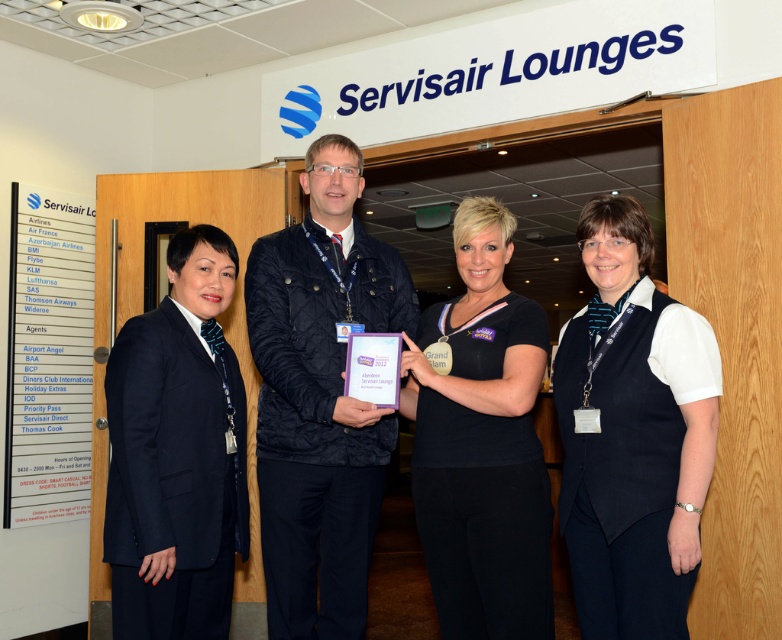
You are at the event and want to take a photo of both the person at point [357,593] and the person at point [221,403]. Since one is behind the other, how should you position yourself to capture both in the frame?

To capture both the person at point [357,593] and the person at point [221,403] in the frame, position yourself so that the person at point [221,403] is in front, allowing the person behind at point [357,593] to be visible through the gap or space between them. Since point [357,593] is behind point [221,403], this arrangement ensures both are visible without obstruction.

You are organizing a photo shoot and need to ensure that the dark blue quilted jacket at center and the navy blue suit at left are visible in the frame. Given that the camera has a limited zoom range, which object should you prioritize to ensure it fits within the frame first?

The dark blue quilted jacket at center is larger in size than the navy blue suit at left, so you should prioritize ensuring the dark blue quilted jacket at center fits within the frame first to accommodate its larger size.

You are organizing a photo shoot and need to place two items on a table. The items are the dark blue quilted jacket at center and the black fabric shirt at center. Which item will require more horizontal space on the table?

The dark blue quilted jacket at center requires more horizontal space on the table because its width is larger than the black fabric shirt at center.